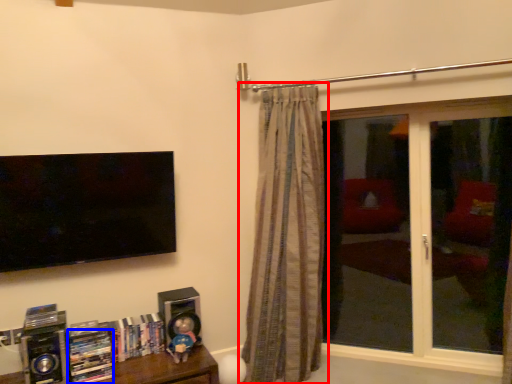
Question: Which object appears farthest to the camera in this image, curtain (highlighted by a red box) or book (highlighted by a blue box)?

Choices:
 (A) curtain
 (B) book

Answer: (A)